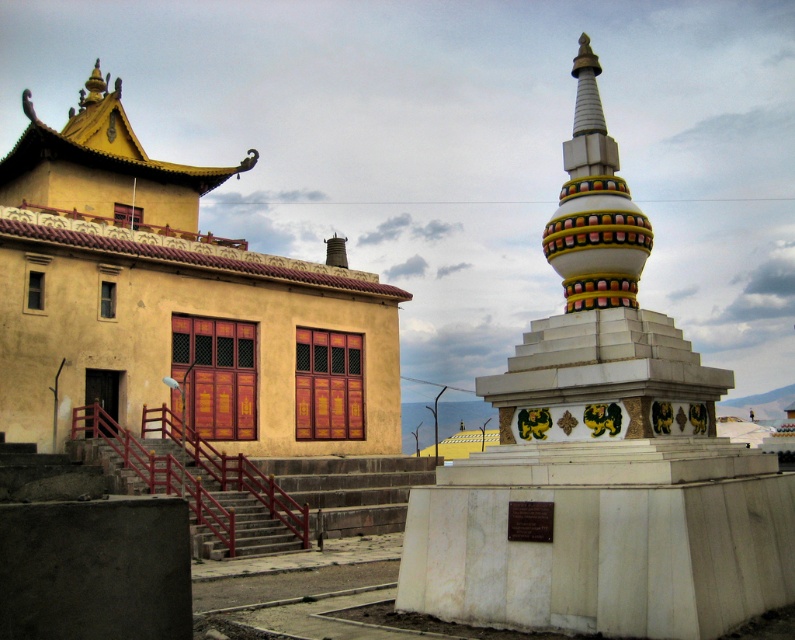
Question: Is metallic red stairs at center bigger than white glossy stupa at center?

Choices:
 (A) yes
 (B) no

Answer: (A)

Question: Among these objects, which one is nearest to the camera?

Choices:
 (A) white glossy stupa at center
 (B) metallic red stairs at center

Answer: (A)

Question: Which point is closer to the camera?

Choices:
 (A) metallic red stairs at center
 (B) white glossy stupa at center

Answer: (B)

Question: Is metallic red stairs at center below white glossy stupa at center?

Choices:
 (A) yes
 (B) no

Answer: (A)

Question: From the image, what is the correct spatial relationship of metallic red stairs at center in relation to white glossy stupa at center?

Choices:
 (A) left
 (B) right

Answer: (A)